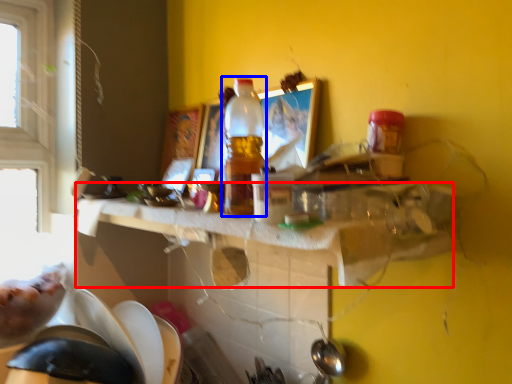
Question: Which object is further to the camera taking this photo, counter top (highlighted by a red box) or bottle (highlighted by a blue box)?

Choices:
 (A) counter top
 (B) bottle

Answer: (B)